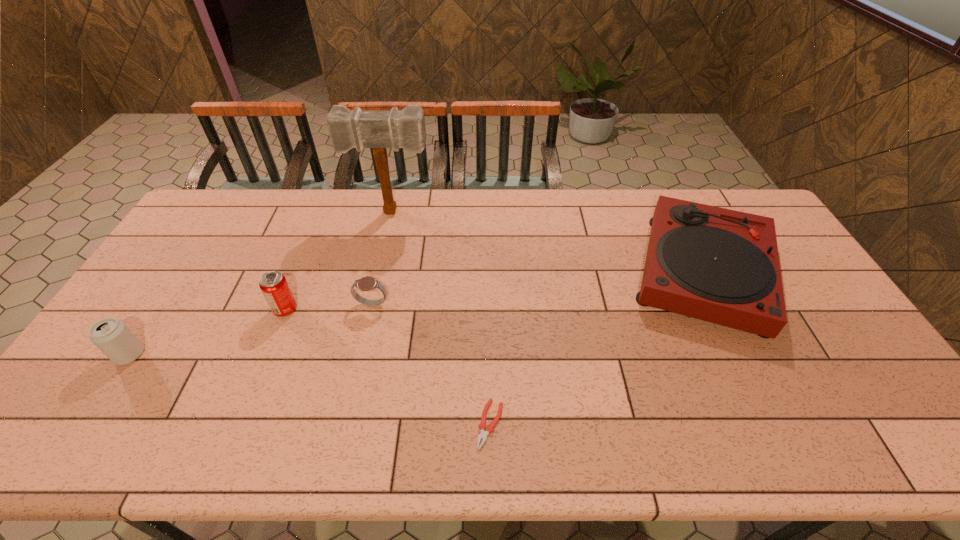
The image size is (960, 540). Identify the location of the tallest object. (379, 130).

The height and width of the screenshot is (540, 960). I want to click on soda can, so click(273, 284).

Locate an element on the screen. the rightmost object is located at coordinates (719, 265).

I want to click on can, so click(x=110, y=335).

Locate an element on the screen. Image resolution: width=960 pixels, height=540 pixels. watch is located at coordinates (366, 283).

Find the location of a particular element. the shortest object is located at coordinates (490, 429).

Identify the location of the second object from right to left. This screenshot has height=540, width=960. (490, 429).

Where is `vacant space located on the left of the tallest object`? vacant space located on the left of the tallest object is located at coordinates (261, 212).

Locate an element on the screen. vacant area located 0.320m on the left of the soda can is located at coordinates (163, 309).

Find the location of `vacant space located on the front of the record player`. vacant space located on the front of the record player is located at coordinates (760, 387).